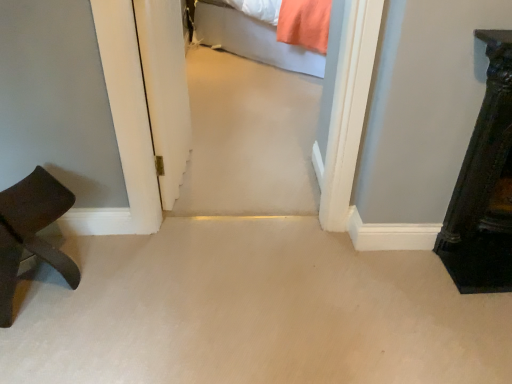
The width and height of the screenshot is (512, 384). Find the location of `unoccupied region to the right of transparent glass door at center`. unoccupied region to the right of transparent glass door at center is located at coordinates (238, 180).